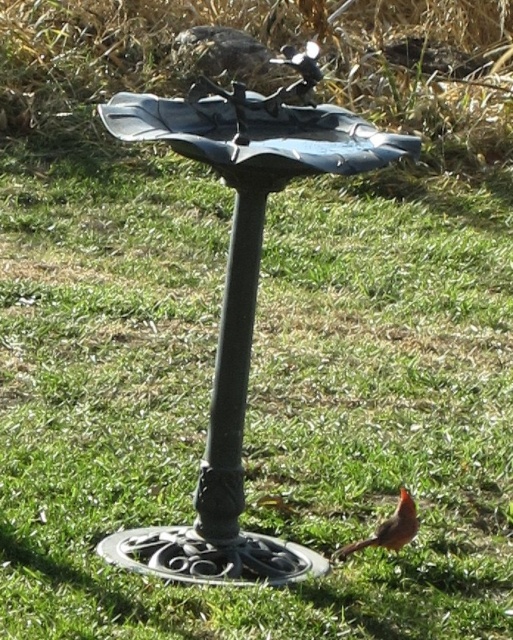
Measure the distance between point (245, 244) and camera.

Point (245, 244) and camera are 3.26 meters apart from each other.

Does black metal pole at center have a larger size compared to matte orange bird at lower right?

Indeed, black metal pole at center has a larger size compared to matte orange bird at lower right.

Is point (230, 442) positioned behind point (398, 545)?

No, (230, 442) is closer to viewer.

Locate an element on the screen. black metal pole at center is located at coordinates (231, 376).